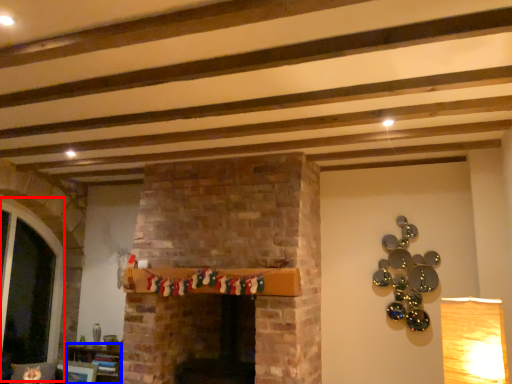
Question: Which object appears closest to the camera in this image, glass door (highlighted by a red box) or furniture (highlighted by a blue box)?

Choices:
 (A) glass door
 (B) furniture

Answer: (A)